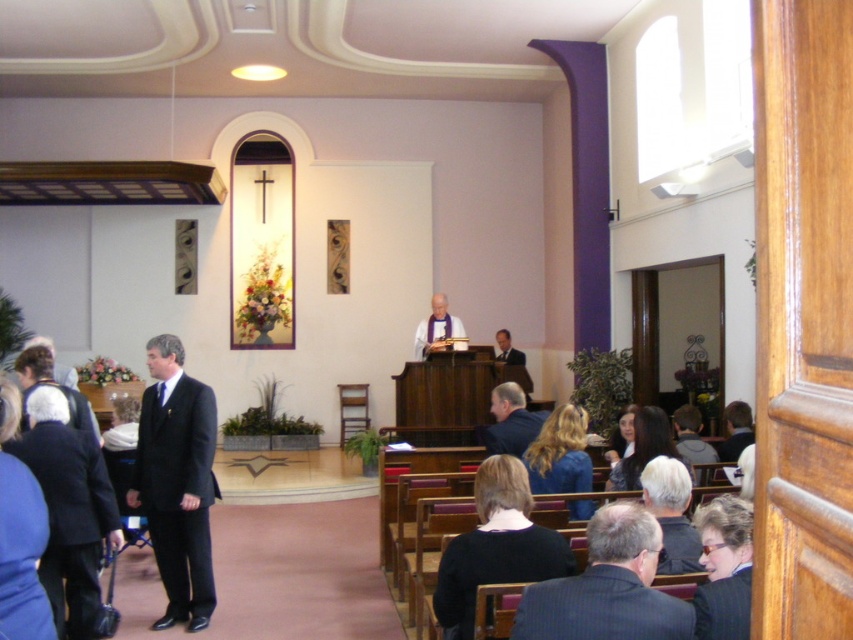
You are attending a church service and notice two individuals wearing suits. One is wearing a dark blue suit at center and the other a dark brown suit at lower right. From your seated position in the pew, which suit is positioned higher in the image?

The dark blue suit at center is positioned higher than the dark brown suit at lower right in the image.

You are standing at the entrance of the church and want to approach the gray hair at lower right and the dark suit at lower left. Which one is closer to you?

The gray hair at lower right is 11.04 feet away from dark suit at lower left. Since you are at the entrance, it depends on their positions relative to you. However, based on the given distance between them, we cannot determine which is closer without additional information about their exact locations from the entrance.